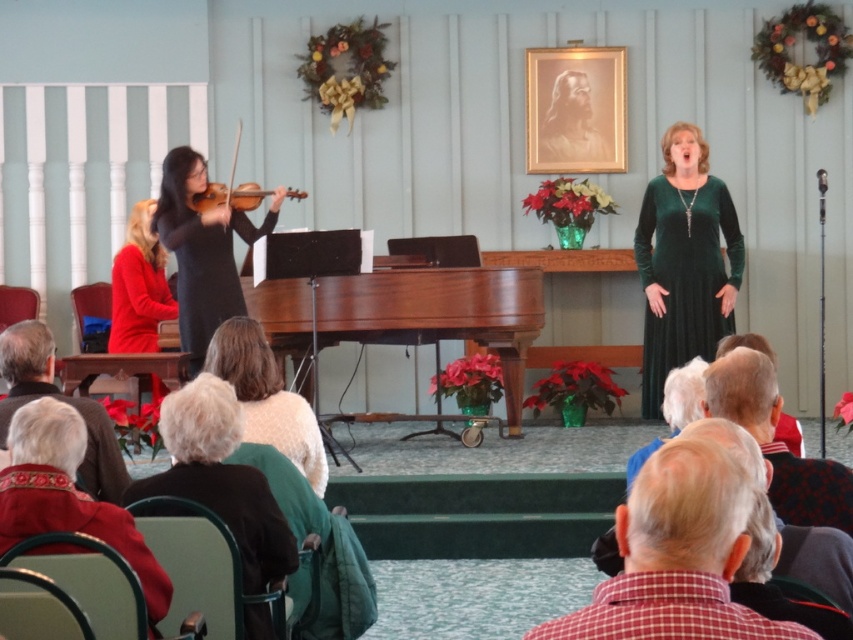
Question: Which of the following is the closest to the observer?

Choices:
 (A) velvet red coat at lower left
 (B) dark green sweater at lower center
 (C) gray wool sweater at lower left
 (D) matte red dress at left

Answer: (A)

Question: Which object is the farthest from the velvet red coat at lower left?

Choices:
 (A) velvet green dress at center
 (B) matte red dress at left

Answer: (A)

Question: Is matte red dress at left to the left of wooden violin at left from the viewer's perspective?

Choices:
 (A) yes
 (B) no

Answer: (A)

Question: Can you confirm if velvet green dress at center is wider than velvet red coat at lower left?

Choices:
 (A) yes
 (B) no

Answer: (A)

Question: Which point is closer to the camera taking this photo?

Choices:
 (A) coord(254,522)
 (B) coord(33,387)
 (C) coord(654,529)

Answer: (C)

Question: From the image, what is the correct spatial relationship of white fuzzy sweater at lower center in relation to wooden violin at left?

Choices:
 (A) left
 (B) right

Answer: (B)